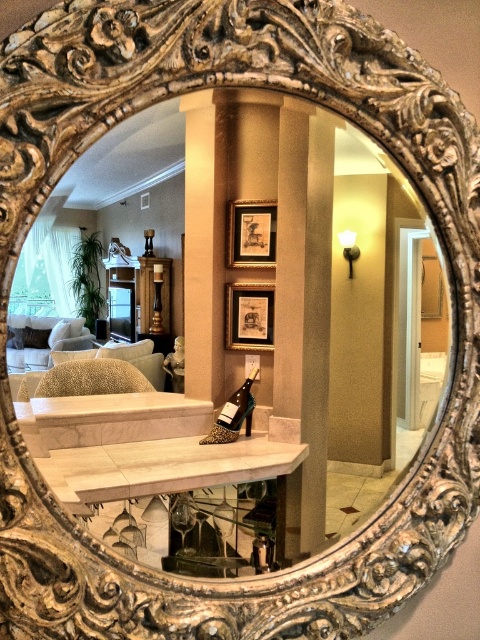
Can you confirm if gold metallic picture frame at center is positioned to the left of matte gold picture frame at center?

In fact, gold metallic picture frame at center is to the right of matte gold picture frame at center.

Is point (238, 266) closer to viewer compared to point (260, 296)?

Yes, it is in front of point (260, 296).

Who is more forward, [252,257] or [226,289]?

Point [252,257] is in front.

This screenshot has width=480, height=640. I want to click on gold metallic picture frame at center, so click(251, 234).

Is beige textured pillar at center in front of gold metallic picture frame at center?

Yes, it is.

Based on the photo, who is more distant from viewer, (187,269) or (257,228)?

Positioned behind is point (257,228).

Between point (217, 180) and point (228, 212), which one is positioned behind?

The point (228, 212) is behind.

The height and width of the screenshot is (640, 480). In order to click on beige textured pillar at center in this screenshot , I will do `click(204, 241)`.

Is point (322, 225) closer to camera compared to point (229, 234)?

No.

Who is more forward, (166, 472) or (255, 250)?

Point (166, 472) is in front.

Find the location of a particular element. This screenshot has height=640, width=480. gold ornate mirror at center is located at coordinates (252, 356).